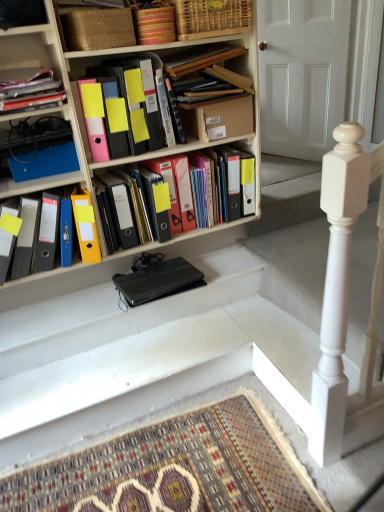
Question: Is yellow matte folder at center, which appears as the 4th book when viewed from the top, facing away from patterned carpet at bottom?

Choices:
 (A) no
 (B) yes

Answer: (A)

Question: Would you say yellow matte folder at center, which appears as the 4th book when viewed from the top, is outside patterned carpet at bottom?

Choices:
 (A) no
 (B) yes

Answer: (B)

Question: Is yellow matte folder at center, which appears as the 4th book when viewed from the top, not close to patterned carpet at bottom?

Choices:
 (A) no
 (B) yes

Answer: (A)

Question: Is patterned carpet at bottom located within yellow matte folder at center, which appears as the 4th book when viewed from the top?

Choices:
 (A) yes
 (B) no

Answer: (B)

Question: Could you tell me if yellow matte folder at center, the 2th book in the bottom-to-top sequence, is turned towards patterned carpet at bottom?

Choices:
 (A) no
 (B) yes

Answer: (A)

Question: From the image's perspective, is yellow matte folder at center, the 2th book in the bottom-to-top sequence, under patterned carpet at bottom?

Choices:
 (A) no
 (B) yes

Answer: (A)

Question: Considering the relative sizes of woven bamboo basket at upper center, the 1th basket in the right-to-left sequence, and patterned carpet at bottom in the image provided, is woven bamboo basket at upper center, the 1th basket in the right-to-left sequence, smaller than patterned carpet at bottom?

Choices:
 (A) yes
 (B) no

Answer: (A)

Question: Is woven bamboo basket at upper center, the 1th basket in the right-to-left sequence, at the right side of patterned carpet at bottom?

Choices:
 (A) no
 (B) yes

Answer: (B)

Question: Is the position of woven bamboo basket at upper center, arranged as the 2th basket when viewed from the left, less distant than that of patterned carpet at bottom?

Choices:
 (A) no
 (B) yes

Answer: (A)

Question: From the image's perspective, does woven bamboo basket at upper center, arranged as the 2th basket when viewed from the left, appear lower than patterned carpet at bottom?

Choices:
 (A) yes
 (B) no

Answer: (B)

Question: Is woven bamboo basket at upper center, the 1th basket in the right-to-left sequence, positioned behind patterned carpet at bottom?

Choices:
 (A) yes
 (B) no

Answer: (A)

Question: Considering the relative positions of woven bamboo basket at upper center, the 1th basket in the right-to-left sequence, and patterned carpet at bottom in the image provided, is woven bamboo basket at upper center, the 1th basket in the right-to-left sequence, to the left of patterned carpet at bottom from the viewer's perspective?

Choices:
 (A) yes
 (B) no

Answer: (B)

Question: Does yellow matte folder at center, the 2th book in the bottom-to-top sequence, have a larger size compared to black matte laptop at center?

Choices:
 (A) yes
 (B) no

Answer: (A)